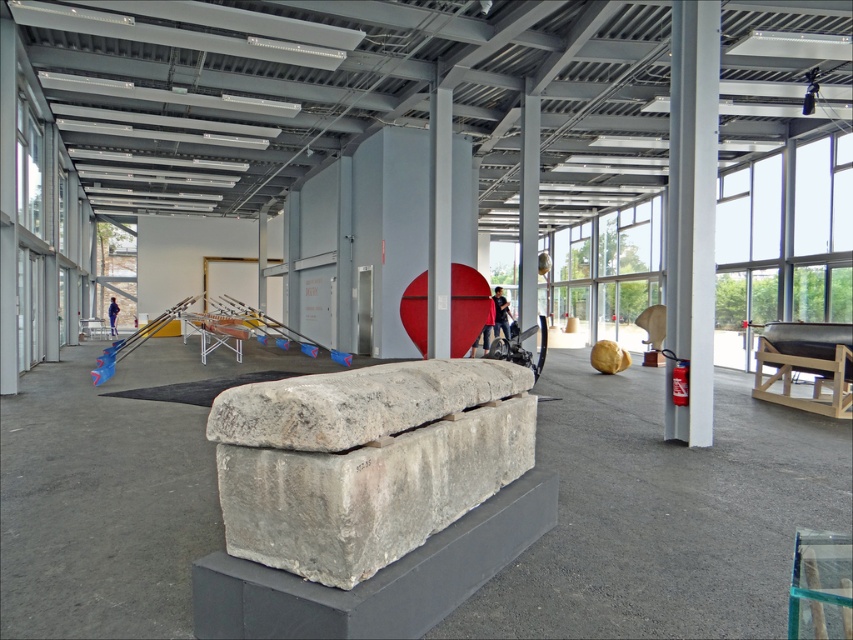
You are standing in the gallery and see two people dressed in fabric costumes. The black fabric person at center and the blue fabric person at center. Which one is positioned to the right?

The black fabric person at center is positioned to the right of the blue fabric person at center.

You are standing in the exhibition hall and want to take a photo of the point at coordinates point (502, 323). If your camera has a maximum focus range of 15 meters, will it be able to focus on the point?

The distance of point (502, 323) from the camera is 14.84 meters, which is within the camera maximum focus range of 15 meters. Therefore, the camera can focus on the point.